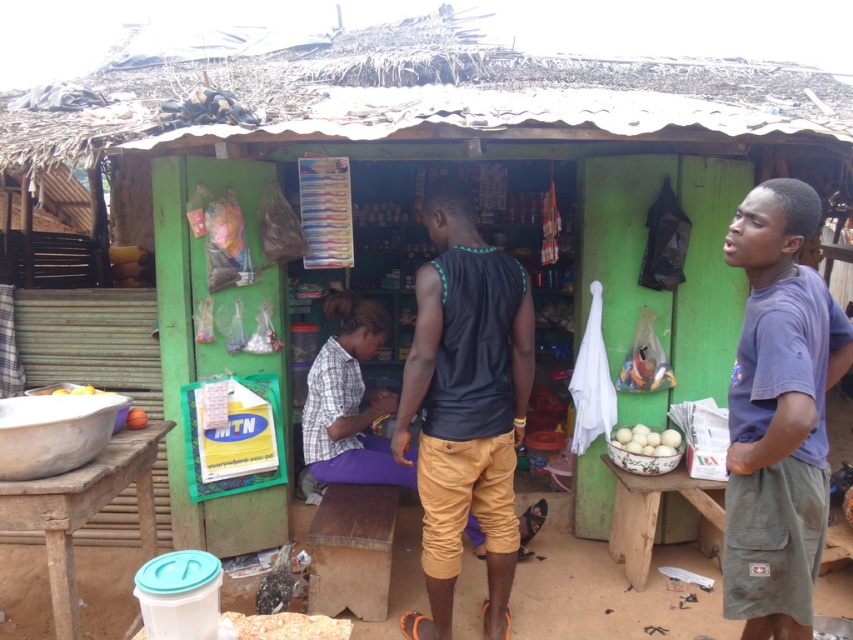
Question: Is black matte tank top at center above white matte eggs at center?

Choices:
 (A) no
 (B) yes

Answer: (B)

Question: Which of the following is the farthest from the observer?

Choices:
 (A) yellow matte fruit at lower left
 (B) blue cotton shirt at right
 (C) white matte eggs at center
 (D) black matte tank top at center

Answer: (C)

Question: Is black matte tank top at center positioned behind yellow matte fruit at lower left?

Choices:
 (A) yes
 (B) no

Answer: (B)

Question: Which point appears farthest from the camera in this image?

Choices:
 (A) (819, 291)
 (B) (631, 432)
 (C) (38, 392)

Answer: (B)

Question: Which of the following is the farthest from the observer?

Choices:
 (A) white matte eggs at center
 (B) yellow matte fruit at lower left
 (C) black matte tank top at center

Answer: (A)

Question: Does white matte eggs at center appear on the left side of yellow matte fruit at lower left?

Choices:
 (A) yes
 (B) no

Answer: (B)